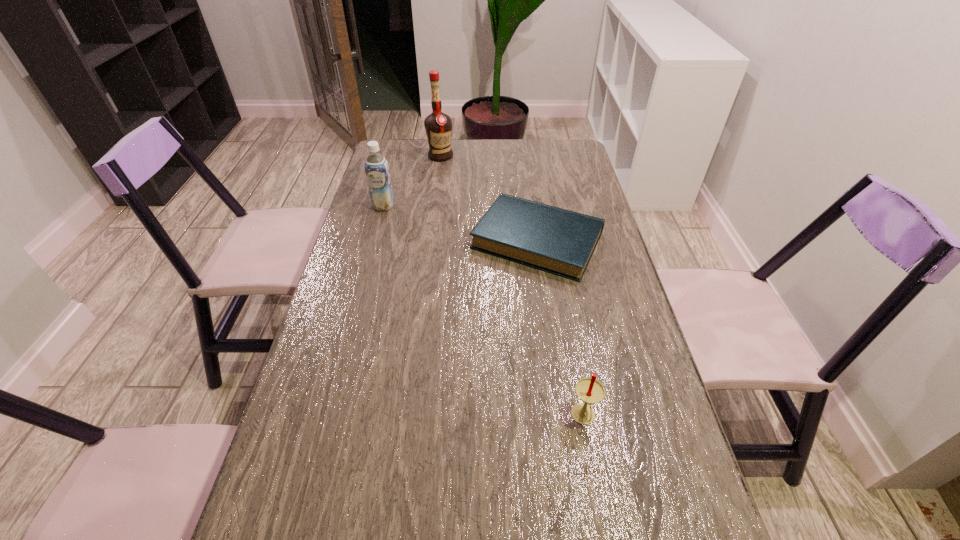
Locate which object ranks in proximity to the nearest object. Please provide its 2D coordinates. Your answer should be formatted as a tuple, i.e. [(x, y)], where the tuple contains the x and y coordinates of a point satisfying the conditions above.

[(559, 241)]

Identify the location of vacant space that satisfies the following two spatial constraints: 1. on the label of the shortest object; 2. on the left side of the soya milk. (374, 240).

Where is `vacant position in the image that satisfies the following two spatial constraints: 1. on the front and back of the third object from right to left; 2. on the right side of the book`? vacant position in the image that satisfies the following two spatial constraints: 1. on the front and back of the third object from right to left; 2. on the right side of the book is located at coordinates (429, 240).

This screenshot has height=540, width=960. Identify the location of free spot that satisfies the following two spatial constraints: 1. on the label of the third tallest object; 2. on the left side of the leftmost object. (326, 417).

Locate an element on the screen. This screenshot has height=540, width=960. free spot that satisfies the following two spatial constraints: 1. on the label of the nearest object; 2. on the left side of the third shortest object is located at coordinates (326, 417).

This screenshot has width=960, height=540. In order to click on vacant region that satisfies the following two spatial constraints: 1. on the label of the third shortest object; 2. on the left side of the second shortest object in this screenshot , I will do `click(326, 417)`.

Where is `free spot that satisfies the following two spatial constraints: 1. on the front and back of the farthest object; 2. on the left side of the nearest object`? free spot that satisfies the following two spatial constraints: 1. on the front and back of the farthest object; 2. on the left side of the nearest object is located at coordinates (406, 417).

The width and height of the screenshot is (960, 540). I want to click on free region that satisfies the following two spatial constraints: 1. on the label of the third tallest object; 2. on the right side of the soya milk, so click(x=326, y=417).

I want to click on blank space that satisfies the following two spatial constraints: 1. on the label of the leftmost object; 2. on the right side of the candle, so click(326, 417).

Where is `free spot that satisfies the following two spatial constraints: 1. on the front and back of the book; 2. on the right side of the farthest object`? This screenshot has width=960, height=540. free spot that satisfies the following two spatial constraints: 1. on the front and back of the book; 2. on the right side of the farthest object is located at coordinates (429, 240).